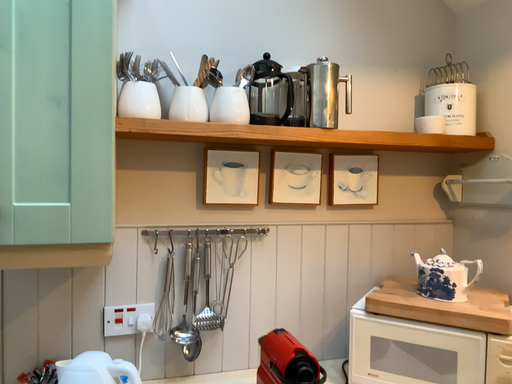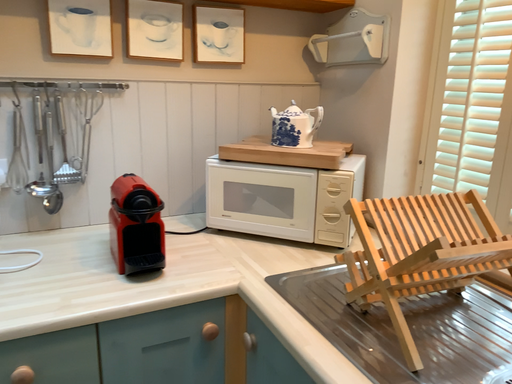
Question: How did the camera likely rotate when shooting the video?

Choices:
 (A) rotated upward
 (B) rotated downward

Answer: (B)